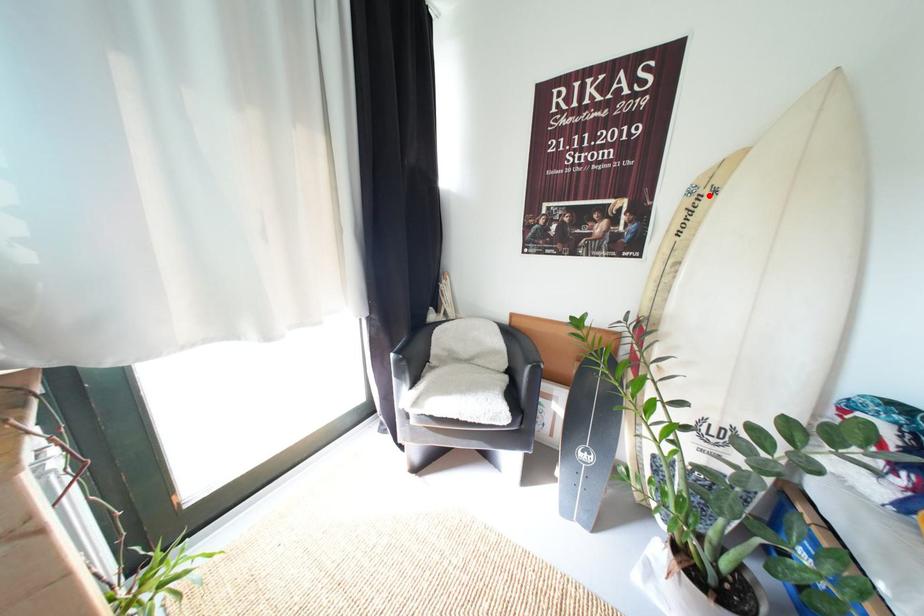
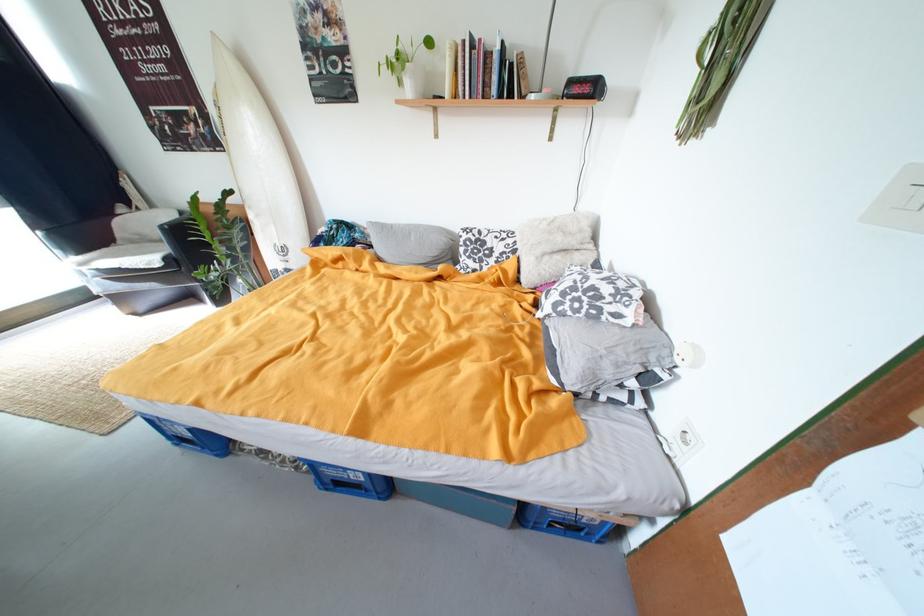
Where in the second image is the point corresponding to the highlighted location from the first image?

(225, 108)